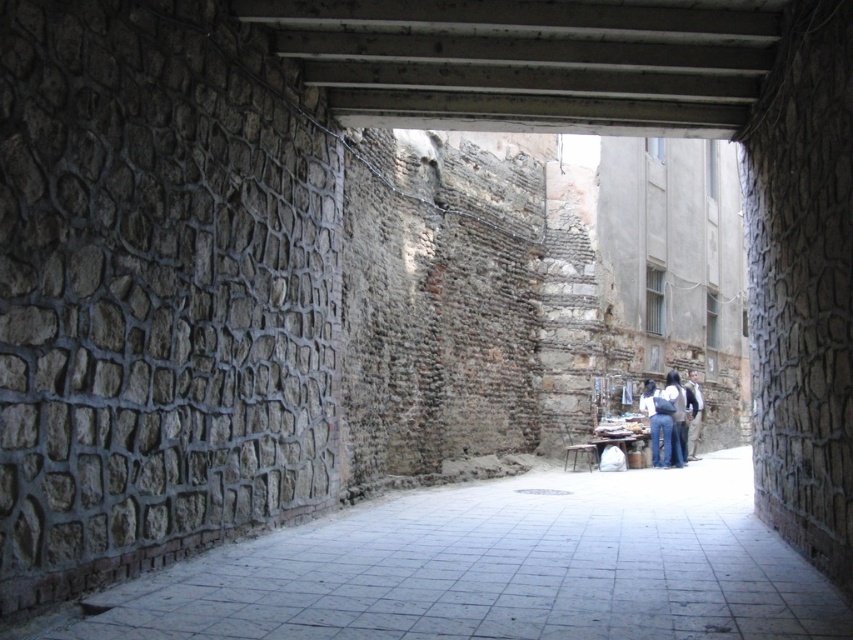
You are a delivery person carrying a package that requires a height clearance of 1.6 meters. You see the blue jeans at center and the light brown leather jacket at lower right in the alleyway. Which object is taller, and will the package fit through the alleyway?

The light brown leather jacket at lower right is taller than the blue jeans at center. However, the height clearance of the alleyway itself is not provided, so it is unclear if the package will fit. The objects do not determine the alleyway height.

You are standing at the entrance of the alleyway and see two points marked on the ground. The first point is at coordinates point (654, 449) and the second is at point (685, 429). Which point is closer to the end of the alleyway?

Point (654, 449) is in front of point (685, 429), so it is closer to the end of the alleyway.